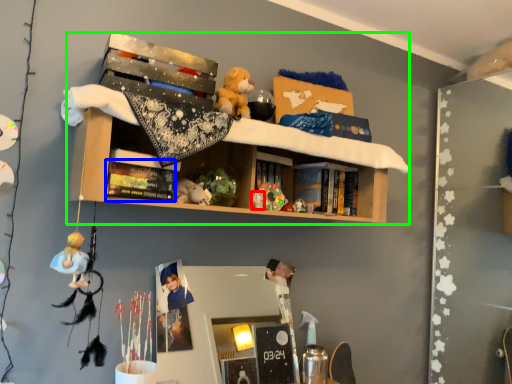
Question: Estimate the real-world distances between objects in this image. Which object is farther from toy (highlighted by a red box), book (highlighted by a blue box) or shelf (highlighted by a green box)?

Choices:
 (A) book
 (B) shelf

Answer: (B)